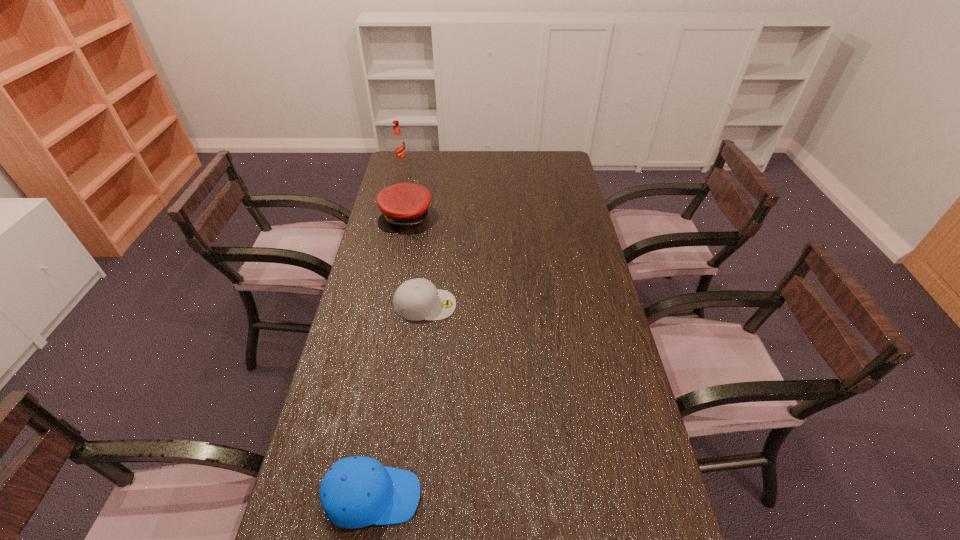
I want to click on free space between the second farthest object and the nearest cap, so click(390, 356).

Where is `vacant point located between the second farthest cap and the farthest cap`? The image size is (960, 540). vacant point located between the second farthest cap and the farthest cap is located at coordinates (416, 261).

Image resolution: width=960 pixels, height=540 pixels. I want to click on unoccupied position between the shortest object and the nearest object, so click(x=399, y=401).

The width and height of the screenshot is (960, 540). What are the coordinates of `free spot between the nearest object and the root beer` in the screenshot? It's located at (387, 330).

The width and height of the screenshot is (960, 540). Find the location of `vacant region between the nearest cap and the farthest cap`. vacant region between the nearest cap and the farthest cap is located at coordinates click(x=390, y=356).

This screenshot has height=540, width=960. In order to click on vacant area that lies between the farthest object and the shortest object in this screenshot , I will do `click(413, 234)`.

Where is `object that can be found as the closest to the second nearest object`? object that can be found as the closest to the second nearest object is located at coordinates (404, 205).

This screenshot has height=540, width=960. I want to click on object that is the closest one to the second nearest cap, so click(x=404, y=205).

The image size is (960, 540). In order to click on cap that can be found as the closest to the root beer in this screenshot , I will do `click(404, 205)`.

Identify which cap is located as the second nearest to the farthest object. Please provide its 2D coordinates. Your answer should be formatted as a tuple, i.e. [(x, y)], where the tuple contains the x and y coordinates of a point satisfying the conditions above.

[(417, 299)]